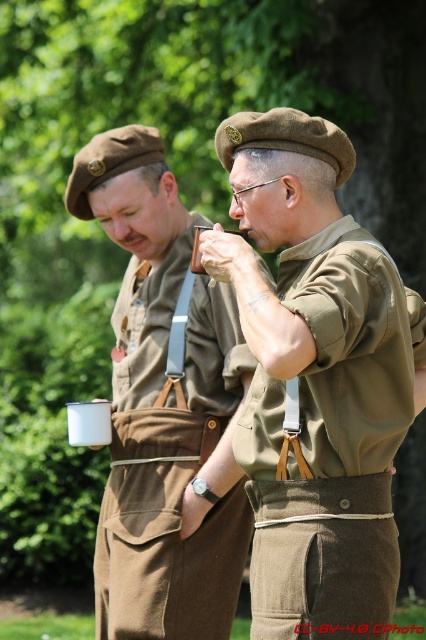
Question: Does matte khaki shirt at center come in front of matte brown uniform at center?

Choices:
 (A) no
 (B) yes

Answer: (B)

Question: Which point is farther to the camera?

Choices:
 (A) (331, 568)
 (B) (173, 532)

Answer: (B)

Question: Does matte khaki shirt at center have a lesser width compared to matte brown uniform at center?

Choices:
 (A) yes
 (B) no

Answer: (B)

Question: Can you confirm if matte khaki shirt at center is positioned below matte brown uniform at center?

Choices:
 (A) yes
 (B) no

Answer: (B)

Question: Which point is farther from the camera taking this photo?

Choices:
 (A) (94, 548)
 (B) (319, 394)

Answer: (A)